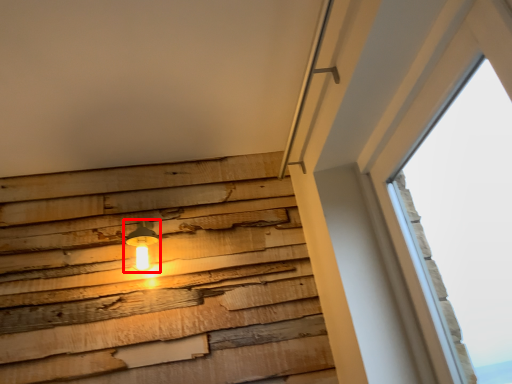
Question: From the image's perspective, where is lamp (annotated by the red box) located in relation to window in the image?

Choices:
 (A) below
 (B) above

Answer: (A)